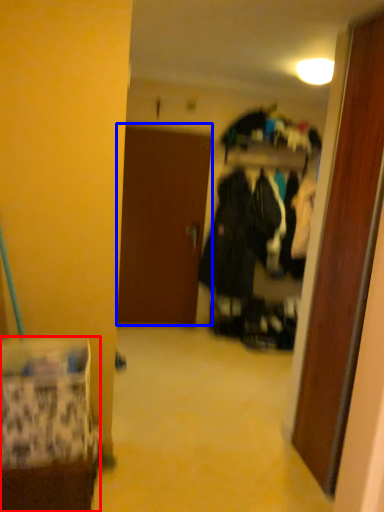
Question: Which of the following is the farthest to the observer, furniture (highlighted by a red box) or door (highlighted by a blue box)?

Choices:
 (A) furniture
 (B) door

Answer: (B)